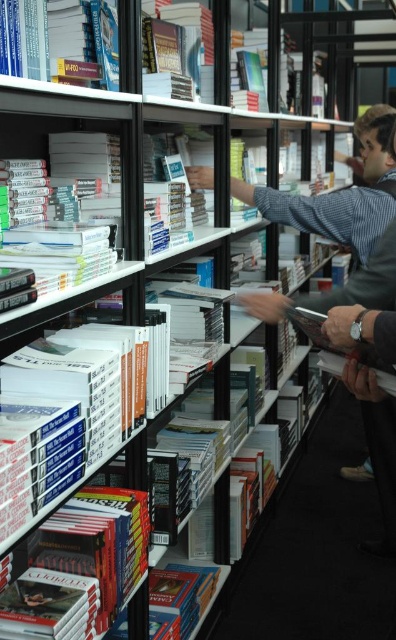
You are a librarian trying to place a new book on a shelf that can only hold books narrower than the hardcover book at lower center. You have a book that is the same size as the hardcover book at upper left. Will it fit on the shelf?

The hardcover book at upper left has a lesser width compared to the hardcover book at lower center, so yes, the new book will fit on the shelf since it is narrower than the maximum allowed width.

Looking at this image, you are a customer in the bookstore and want to reach the hardcover book at upper left from where you are standing. The store has a 1.2 meter wide aisle between the shelves. Can you walk through the aisle to get to the book?

The distance between you and the hardcover book at upper left is 1.07 meters, so yes, you can walk through the 1.2 meter wide aisle to reach the book since the aisle is wider than the required space.